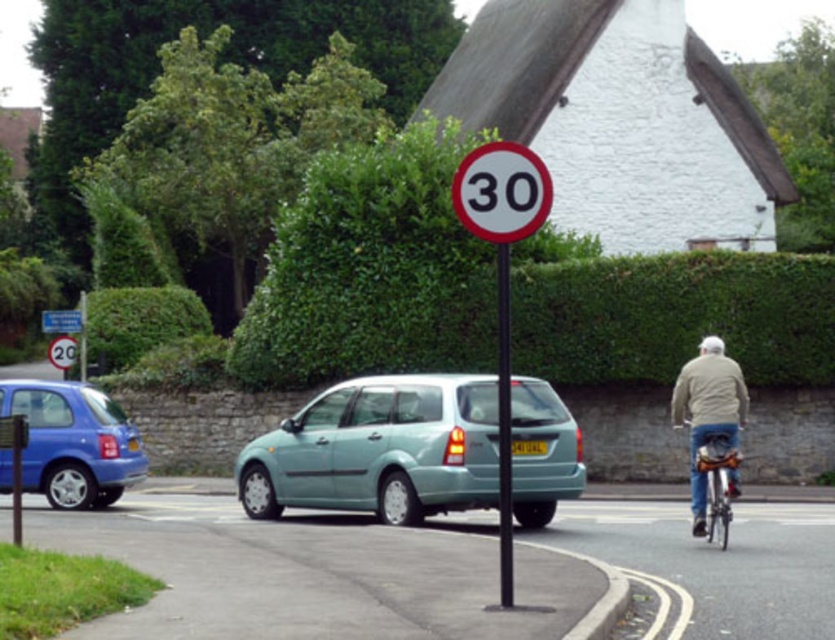
Between light blue matte hatchback at center and metallic silver bicycle at right, which one is positioned higher?

light blue matte hatchback at center is above.

The width and height of the screenshot is (835, 640). What are the coordinates of `light blue matte hatchback at center` in the screenshot? It's located at (380, 449).

Between white plastic speed limit sign at center and yellow metallic license plate at center, which one has more height?

With more height is white plastic speed limit sign at center.

Can you confirm if white plastic speed limit sign at center is smaller than yellow metallic license plate at center?

No, white plastic speed limit sign at center is not smaller than yellow metallic license plate at center.

Image resolution: width=835 pixels, height=640 pixels. Find the location of `white plastic speed limit sign at center`. white plastic speed limit sign at center is located at coordinates (502, 276).

Is metallic blue hatchback at left closer to the viewer compared to metallic silver bicycle at right?

No, metallic blue hatchback at left is behind metallic silver bicycle at right.

Which is below, metallic blue hatchback at left or metallic silver bicycle at right?

Positioned lower is metallic blue hatchback at left.

In the scene shown: Who is more forward, (52,384) or (697,438)?

Point (697,438) is more forward.

This screenshot has height=640, width=835. What are the coordinates of `metallic blue hatchback at left` in the screenshot? It's located at (73, 442).